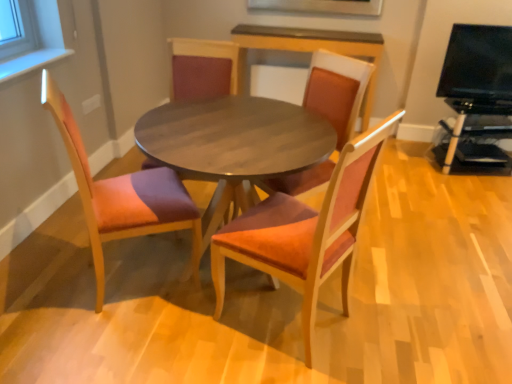
This screenshot has height=384, width=512. I want to click on vacant space situated on the left part of orange fabric chair at left, the first chair from the left, so pos(45,269).